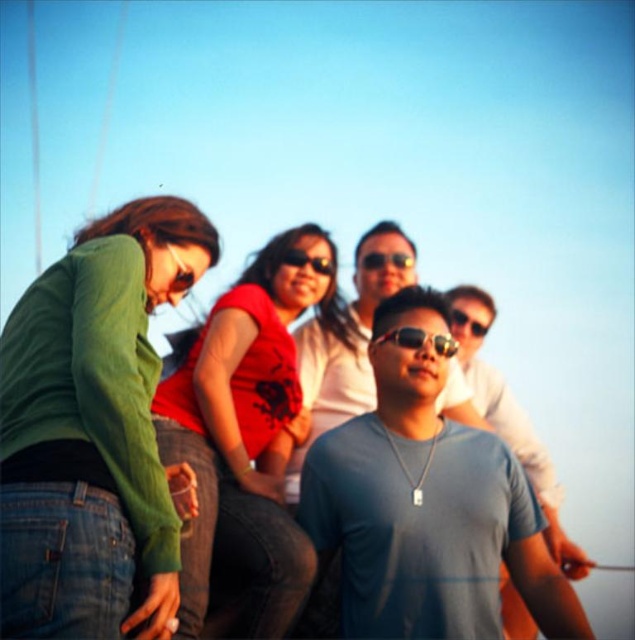
Question: Estimate the real-world distances between objects in this image. Which object is closer to the matte black sunglasses at upper left?

Choices:
 (A) matte gray shirt at center
 (B) black plastic sunglasses at center
 (C) matte black sunglasses at center

Answer: (A)

Question: Is green matte shirt at lower left to the left of matte black sunglasses at center from the viewer's perspective?

Choices:
 (A) yes
 (B) no

Answer: (A)

Question: Which is farther from the green matte shirt at lower left?

Choices:
 (A) black reflective sunglasses at center
 (B) matte gray shirt at center
 (C) black plastic sunglasses at center
 (D) matte black sunglasses at center

Answer: (C)

Question: Which point is farther to the camera?

Choices:
 (A) sunglasses at center
 (B) black plastic sunglasses at center

Answer: (B)

Question: Can you confirm if matte gray shirt at center is smaller than matte black sunglasses at upper left?

Choices:
 (A) no
 (B) yes

Answer: (A)

Question: Does matte gray shirt at center have a smaller size compared to matte black sunglasses at center?

Choices:
 (A) yes
 (B) no

Answer: (B)